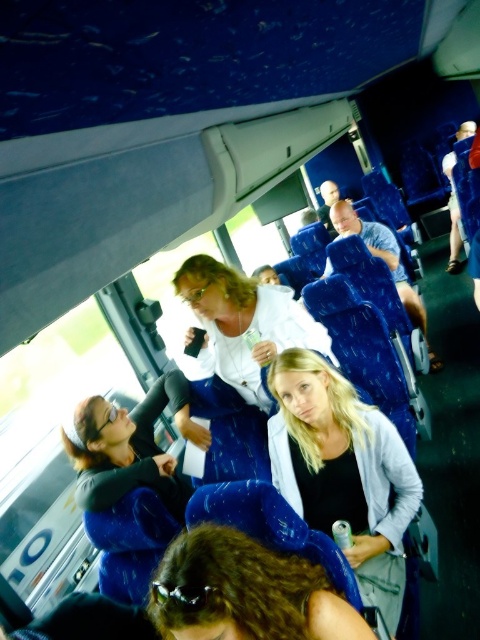
Question: Which of the following is the closest to the observer?

Choices:
 (A) (288, 332)
 (B) (356, 486)

Answer: (B)

Question: Is light blue denim jacket at center to the left of matte black jacket at center from the viewer's perspective?

Choices:
 (A) yes
 (B) no

Answer: (B)

Question: Considering the real-world distances, which object is closest to the shiny brown hair at lower center?

Choices:
 (A) white matte jacket at center
 (B) blue fabric seat at center
 (C) matte black jacket at center

Answer: (C)

Question: Among these points, which one is farthest from the camera?

Choices:
 (A) (122, 600)
 (B) (202, 268)
 (C) (352, 506)
 (D) (173, 636)

Answer: (B)

Question: Is shiny brown hair at lower center bigger than blue fabric seat at center?

Choices:
 (A) yes
 (B) no

Answer: (B)

Question: Considering the relative positions of shiny brown hair at lower center and white matte jacket at center in the image provided, where is shiny brown hair at lower center located with respect to white matte jacket at center?

Choices:
 (A) right
 (B) left

Answer: (A)